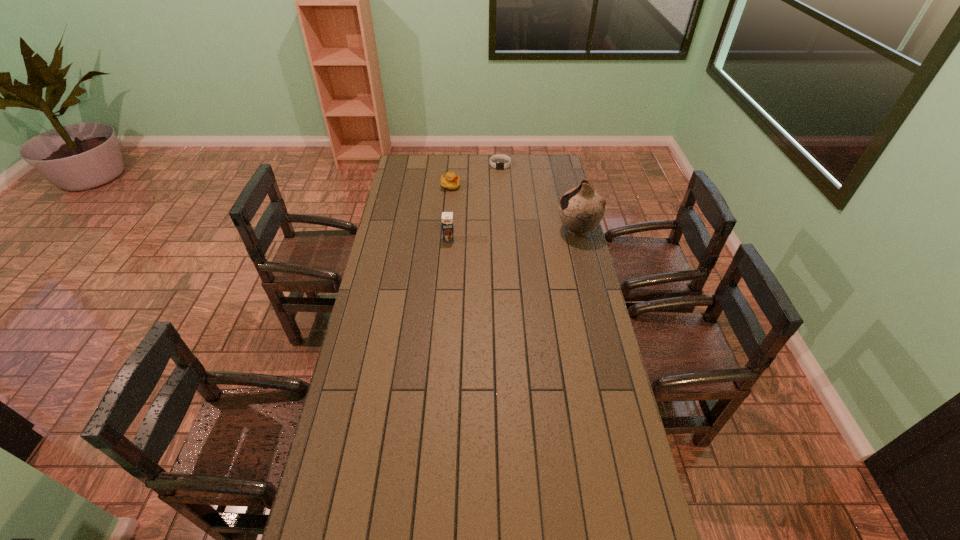
At what (x,y) coordinates should I click in order to perform the action: click on vacant space located 0.230m from the spout of the pottery. Please return your answer as a coordinate pair (x, y). The image size is (960, 540). Looking at the image, I should click on (507, 230).

At what (x,y) coordinates should I click in order to perform the action: click on vacant area situated 0.300m on the outer surface of the wristband. Please return your answer as a coordinate pair (x, y). Looking at the image, I should click on (499, 202).

You are a GUI agent. You are given a task and a screenshot of the screen. Output one action in this format:
    pyautogui.click(x=<x>, y=<y>)
    Task: Click on the vacant space located 0.130m on the outer surface of the wristband
    The width and height of the screenshot is (960, 540).
    Given the screenshot: What is the action you would take?
    pyautogui.click(x=500, y=183)

What are the coordinates of `free space located 0.050m on the outer surface of the wristband` in the screenshot? It's located at (500, 175).

Locate an element on the screen. Image resolution: width=960 pixels, height=540 pixels. free region located at the beak of the third nearest object is located at coordinates (509, 224).

Image resolution: width=960 pixels, height=540 pixels. I want to click on vacant region located 0.060m at the beak of the third nearest object, so click(465, 195).

You are a GUI agent. You are given a task and a screenshot of the screen. Output one action in this format:
    pyautogui.click(x=<x>, y=<y>)
    Task: Click on the vacant area situated at the beak of the third nearest object
    
    Given the screenshot: What is the action you would take?
    pyautogui.click(x=476, y=202)

The height and width of the screenshot is (540, 960). I want to click on object that is at the far edge, so click(498, 165).

At what (x,y) coordinates should I click in order to perform the action: click on object that is positioned at the right edge. Please return your answer as a coordinate pair (x, y). This screenshot has width=960, height=540. Looking at the image, I should click on (581, 209).

Where is `vacant space at the far edge of the desktop`? The width and height of the screenshot is (960, 540). vacant space at the far edge of the desktop is located at coordinates point(486,163).